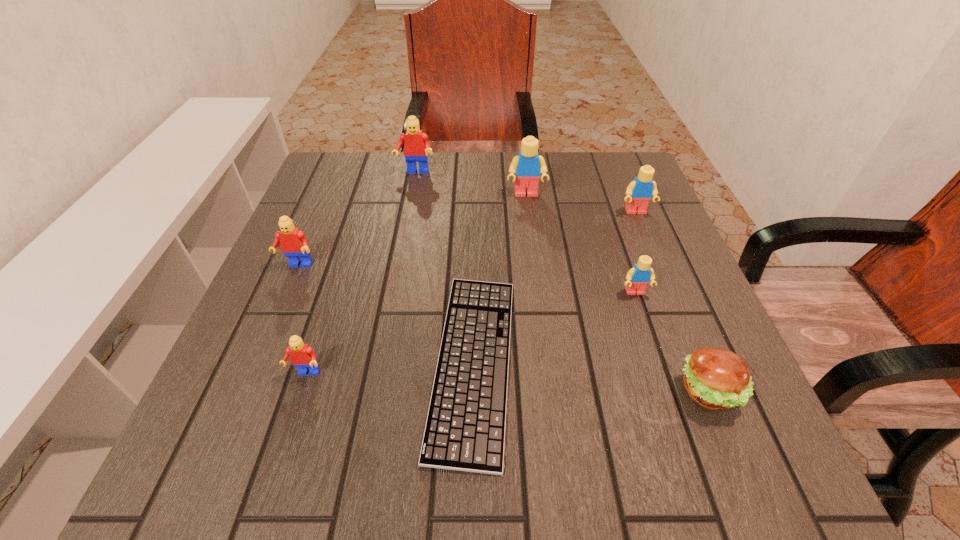
The height and width of the screenshot is (540, 960). Identify the location of blank space located on the front-facing side of the second object from left to right. (276, 468).

The width and height of the screenshot is (960, 540). Find the location of `free space located 0.400m on the back of the hamburger`. free space located 0.400m on the back of the hamburger is located at coordinates (638, 220).

Image resolution: width=960 pixels, height=540 pixels. I want to click on vacant region located 0.260m on the back of the shortest object, so click(475, 206).

Where is `object situated at the near edge`? object situated at the near edge is located at coordinates click(x=465, y=428).

The height and width of the screenshot is (540, 960). Find the location of `hamburger that is at the right edge`. hamburger that is at the right edge is located at coordinates (714, 378).

Find the location of `free region at the far edge`. free region at the far edge is located at coordinates (396, 159).

The width and height of the screenshot is (960, 540). In the image, there is a desktop. Identify the location of free space at the near edge. (332, 484).

Find the location of a particular element. This screenshot has height=540, width=960. free space at the left edge of the desktop is located at coordinates (251, 427).

Identify the location of free spot at the right edge of the desktop. (635, 231).

In the image, there is a desktop. Identify the location of vacant space at the far left corner. Image resolution: width=960 pixels, height=540 pixels. (321, 180).